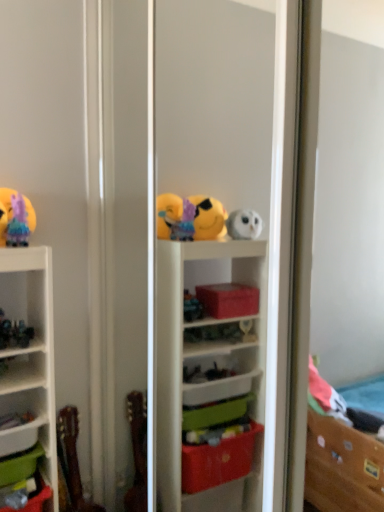
What do you see at coordinates (33, 501) in the screenshot? I see `green plastic storage box at lower left, the second storage box when ordered from top to bottom` at bounding box center [33, 501].

Image resolution: width=384 pixels, height=512 pixels. In order to click on green plastic storage box at lower left, the second storage box when ordered from top to bottom in this screenshot , I will do `click(33, 501)`.

This screenshot has width=384, height=512. Describe the element at coordinates (30, 354) in the screenshot. I see `white matte shelf at lower left` at that location.

Locate an element on the screen. This screenshot has width=384, height=512. metallic green figurine at left, arranged as the 2th toy when viewed from the top is located at coordinates (14, 333).

The width and height of the screenshot is (384, 512). Describe the element at coordinates (15, 218) in the screenshot. I see `pastel rainbow tulle at upper left, which is the 3th toy from bottom to top` at that location.

The width and height of the screenshot is (384, 512). Identify the location of transparent plastic shelf at center. (197, 233).

Is the depth of white matte shelf at lower left greater than that of green plastic storage box at lower left, the second storage box when ordered from top to bottom?

Yes.

Does white matte shelf at lower left appear on the left side of green plastic storage box at lower left, the second storage box when ordered from top to bottom?

Incorrect, white matte shelf at lower left is not on the left side of green plastic storage box at lower left, the second storage box when ordered from top to bottom.

Could you tell me if white matte shelf at lower left is turned towards green plastic storage box at lower left, which ranks as the 1th storage box in bottom-to-top order?

No, white matte shelf at lower left is not oriented towards green plastic storage box at lower left, which ranks as the 1th storage box in bottom-to-top order.

Which point is more forward, (36, 454) or (29, 209)?

Positioned in front is point (36, 454).

From a real-world perspective, which is physically above, green plastic storage box at lower left, the 2th storage box ordered from the bottom, or pastel rainbow tulle at upper left, which is the 3th toy from bottom to top?

From a 3D spatial view, pastel rainbow tulle at upper left, which is the 3th toy from bottom to top, is above.

From the image's perspective, relative to pastel rainbow tulle at upper left, which is the 3th toy from bottom to top, is green plastic storage box at lower left, which is the first storage box from top to bottom, above or below?

green plastic storage box at lower left, which is the first storage box from top to bottom, is below pastel rainbow tulle at upper left, which is the 3th toy from bottom to top.

Does transparent plastic shelf at center have a greater width compared to pastel rainbow tulle at upper left, which is the 3th toy from bottom to top?

Yes, transparent plastic shelf at center is wider than pastel rainbow tulle at upper left, which is the 3th toy from bottom to top.

From a real-world perspective, who is located lower, transparent plastic shelf at center or pastel rainbow tulle at upper left, which is the first toy in top-to-bottom order?

In real-world perspective, transparent plastic shelf at center is lower.

From the image's perspective, which object appears higher, transparent plastic shelf at center or pastel rainbow tulle at upper left, which is the 3th toy from bottom to top?

pastel rainbow tulle at upper left, which is the 3th toy from bottom to top, from the image's perspective.

From the image's perspective, would you say metallic green figurine at left, which is the 2th toy from bottom to top, is positioned over green plastic storage box at lower left, which is the first storage box from top to bottom?

Yes, from the image's perspective, metallic green figurine at left, which is the 2th toy from bottom to top, is on top of green plastic storage box at lower left, which is the first storage box from top to bottom.

From a real-world perspective, is metallic green figurine at left, arranged as the 2th toy when viewed from the top, over green plastic storage box at lower left, which is the first storage box from top to bottom?

Yes, from a real-world perspective, metallic green figurine at left, arranged as the 2th toy when viewed from the top, is above green plastic storage box at lower left, which is the first storage box from top to bottom.

Measure the distance between metallic green figurine at left, arranged as the 2th toy when viewed from the top, and green plastic storage box at lower left, which is the first storage box from top to bottom.

metallic green figurine at left, arranged as the 2th toy when viewed from the top, is 16.39 inches away from green plastic storage box at lower left, which is the first storage box from top to bottom.

How different are the orientations of metallic green figurine at left, which is the 2th toy from bottom to top, and green plastic storage box at lower left, the 2th storage box ordered from the bottom, in degrees?

The angle between the facing direction of metallic green figurine at left, which is the 2th toy from bottom to top, and the facing direction of green plastic storage box at lower left, the 2th storage box ordered from the bottom, is 2.71 degrees.

Is transparent plastic shelf at center facing towards wooden guitar at lower left, the third toy in the top-to-bottom sequence?

Yes, transparent plastic shelf at center faces towards wooden guitar at lower left, the third toy in the top-to-bottom sequence.

Is transparent plastic shelf at center touching wooden guitar at lower left, the third toy in the top-to-bottom sequence?

They are not placed beside each other.

Identify the location of screen door above the wooden guitar at lower left, the third toy in the top-to-bottom sequence (from the image's perspective). The width and height of the screenshot is (384, 512). (197, 233).

Is wooden guitar at lower left, marked as the first toy in a bottom-to-top arrangement, in front of or behind green plastic storage box at lower left, which is the first storage box from top to bottom, in the image?

wooden guitar at lower left, marked as the first toy in a bottom-to-top arrangement, is behind green plastic storage box at lower left, which is the first storage box from top to bottom.

Between wooden guitar at lower left, marked as the first toy in a bottom-to-top arrangement, and green plastic storage box at lower left, the 2th storage box ordered from the bottom, which one has larger size?

wooden guitar at lower left, marked as the first toy in a bottom-to-top arrangement, is bigger.

Considering the relative sizes of wooden guitar at lower left, the third toy in the top-to-bottom sequence, and green plastic storage box at lower left, the 2th storage box ordered from the bottom, in the image provided, is wooden guitar at lower left, the third toy in the top-to-bottom sequence, thinner than green plastic storage box at lower left, the 2th storage box ordered from the bottom,?

Correct, the width of wooden guitar at lower left, the third toy in the top-to-bottom sequence, is less than that of green plastic storage box at lower left, the 2th storage box ordered from the bottom.

Does wooden guitar at lower left, the third toy in the top-to-bottom sequence, turn towards green plastic storage box at lower left, the 2th storage box ordered from the bottom?

No, wooden guitar at lower left, the third toy in the top-to-bottom sequence, is not turned towards green plastic storage box at lower left, the 2th storage box ordered from the bottom.

Is transparent plastic shelf at center facing away from white matte shelf at lower left?

transparent plastic shelf at center is not turned away from white matte shelf at lower left.

How different are the orientations of transparent plastic shelf at center and white matte shelf at lower left in degrees?

The angle between the facing direction of transparent plastic shelf at center and the facing direction of white matte shelf at lower left is 90 degrees.

Considering the positions of objects transparent plastic shelf at center and white matte shelf at lower left in the image provided, who is more to the right, transparent plastic shelf at center or white matte shelf at lower left?

Positioned to the right is transparent plastic shelf at center.

Is point (282, 82) less distant than point (47, 251)?

Yes, point (282, 82) is in front of point (47, 251).

Locate an element on the screen. shelf behind the green plastic storage box at lower left, which ranks as the 1th storage box in bottom-to-top order is located at coordinates point(30,354).

From the green plastic storage box at lower left, the 2th storage box ordered from the bottom, count 2nd toys forward and point to it. Please provide its 2D coordinates.

[(15, 218)]

From the picture: Looking at the image, which one is located further to metallic green figurine at left, arranged as the 2th toy when viewed from the top, wooden guitar at lower left, marked as the first toy in a bottom-to-top arrangement, or green plastic storage box at lower left, which ranks as the 1th storage box in bottom-to-top order?

The object further to metallic green figurine at left, arranged as the 2th toy when viewed from the top, is wooden guitar at lower left, marked as the first toy in a bottom-to-top arrangement.

When comparing their distances from wooden guitar at lower left, the third toy in the top-to-bottom sequence, does green plastic storage box at lower left, which ranks as the 1th storage box in bottom-to-top order, or pastel rainbow tulle at upper left, which is the 3th toy from bottom to top, seem closer?

green plastic storage box at lower left, which ranks as the 1th storage box in bottom-to-top order, lies closer to wooden guitar at lower left, the third toy in the top-to-bottom sequence, than the other object.

From the image, which object appears to be nearer to green plastic storage box at lower left, which is the first storage box from top to bottom, metallic green figurine at left, arranged as the 2th toy when viewed from the top, or green plastic storage box at lower left, which ranks as the 1th storage box in bottom-to-top order?

The object closer to green plastic storage box at lower left, which is the first storage box from top to bottom, is green plastic storage box at lower left, which ranks as the 1th storage box in bottom-to-top order.

Based on their spatial positions, is pastel rainbow tulle at upper left, which is the 3th toy from bottom to top, or transparent plastic shelf at center closer to green plastic storage box at lower left, the 2th storage box ordered from the bottom?

pastel rainbow tulle at upper left, which is the 3th toy from bottom to top, is closer to green plastic storage box at lower left, the 2th storage box ordered from the bottom.

Which object lies further to the anchor point pastel rainbow tulle at upper left, which is the 3th toy from bottom to top, transparent plastic shelf at center or white matte shelf at lower left?

Among the two, transparent plastic shelf at center is located further to pastel rainbow tulle at upper left, which is the 3th toy from bottom to top.

Looking at the image, which one is located further to green plastic storage box at lower left, which ranks as the 1th storage box in bottom-to-top order, transparent plastic shelf at center or green plastic storage box at lower left, the 2th storage box ordered from the bottom?

transparent plastic shelf at center lies further to green plastic storage box at lower left, which ranks as the 1th storage box in bottom-to-top order, than the other object.

Considering their positions, is green plastic storage box at lower left, the 2th storage box ordered from the bottom, positioned closer to white matte shelf at lower left than metallic green figurine at left, which is the 2th toy from bottom to top?

The object closer to white matte shelf at lower left is metallic green figurine at left, which is the 2th toy from bottom to top.

Which object lies further to the anchor point metallic green figurine at left, arranged as the 2th toy when viewed from the top, green plastic storage box at lower left, which is the first storage box from top to bottom, or pastel rainbow tulle at upper left, which is the 3th toy from bottom to top?

green plastic storage box at lower left, which is the first storage box from top to bottom, is positioned further to the anchor metallic green figurine at left, arranged as the 2th toy when viewed from the top.

Locate an element on the screen. The height and width of the screenshot is (512, 384). shelf between pastel rainbow tulle at upper left, which is the 3th toy from bottom to top, and green plastic storage box at lower left, the 2th storage box ordered from the bottom, vertically is located at coordinates (30, 354).

You are a GUI agent. You are given a task and a screenshot of the screen. Output one action in this format:
    pyautogui.click(x=<x>, y=<y>)
    Task: Click on the storage box that lies between metallic green figurine at left, arranged as the 2th toy when viewed from the top, and green plastic storage box at lower left, which ranks as the 1th storage box in bottom-to-top order, from top to bottom
    The width and height of the screenshot is (384, 512).
    Given the screenshot: What is the action you would take?
    pyautogui.click(x=20, y=465)

The image size is (384, 512). Find the location of `screen door between pastel rainbow tulle at upper left, which is the first toy in top-to-bottom order, and green plastic storage box at lower left, the second storage box when ordered from top to bottom, vertically`. screen door between pastel rainbow tulle at upper left, which is the first toy in top-to-bottom order, and green plastic storage box at lower left, the second storage box when ordered from top to bottom, vertically is located at coordinates (197, 233).

At what (x,y) coordinates should I click in order to perform the action: click on storage box between pastel rainbow tulle at upper left, which is the 3th toy from bottom to top, and green plastic storage box at lower left, the second storage box when ordered from top to bottom, from top to bottom. Please return your answer as a coordinate pair (x, y). The height and width of the screenshot is (512, 384). Looking at the image, I should click on (20, 465).